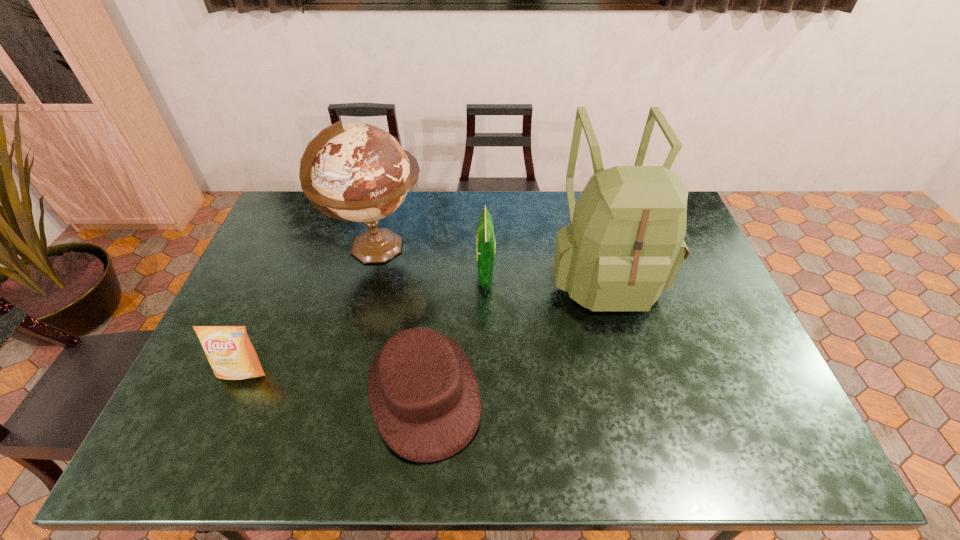
Identify the location of vacant point located between the hat and the taller crisp (potato chip). This screenshot has width=960, height=540. (455, 334).

At what (x,y) coordinates should I click in order to perform the action: click on free space between the left crisp (potato chip) and the shortest object. Please return your answer as a coordinate pair (x, y). This screenshot has height=540, width=960. Looking at the image, I should click on (334, 382).

Locate which object ranks third in proximity to the rightmost object. Please provide its 2D coordinates. Your answer should be formatted as a tuple, i.e. [(x, y)], where the tuple contains the x and y coordinates of a point satisfying the conditions above.

[(360, 173)]

Where is `object that stands as the third closest to the backpack`? This screenshot has width=960, height=540. object that stands as the third closest to the backpack is located at coordinates (360, 173).

You are a GUI agent. You are given a task and a screenshot of the screen. Output one action in this format:
    pyautogui.click(x=<x>, y=<y>)
    Task: Click on the free location that satisfies the following two spatial constraints: 1. on the front of the globe showing Asia; 2. on the right side of the hat
    
    Given the screenshot: What is the action you would take?
    pyautogui.click(x=343, y=393)

This screenshot has height=540, width=960. I want to click on free space that satisfies the following two spatial constraints: 1. on the front-facing side of the right crisp (potato chip); 2. on the front-facing side of the leftmost object, so click(x=487, y=372).

Where is `free space that satisfies the following two spatial constraints: 1. on the front-facing side of the taller crisp (potato chip); 2. on the front-facing side of the nearer crisp (potato chip)`? free space that satisfies the following two spatial constraints: 1. on the front-facing side of the taller crisp (potato chip); 2. on the front-facing side of the nearer crisp (potato chip) is located at coordinates pyautogui.click(x=487, y=372).

Identify the location of free space that satisfies the following two spatial constraints: 1. on the front-facing side of the shorter crisp (potato chip); 2. on the right side of the hat. The width and height of the screenshot is (960, 540). point(234,393).

Image resolution: width=960 pixels, height=540 pixels. In order to click on vacant space that satisfies the following two spatial constraints: 1. on the front of the globe showing Asia; 2. on the front-facing side of the nearer crisp (potato chip) in this screenshot , I will do `click(348, 372)`.

This screenshot has width=960, height=540. I want to click on vacant area in the image that satisfies the following two spatial constraints: 1. on the front pocket of the backpack; 2. on the front-facing side of the farther crisp (potato chip), so click(604, 275).